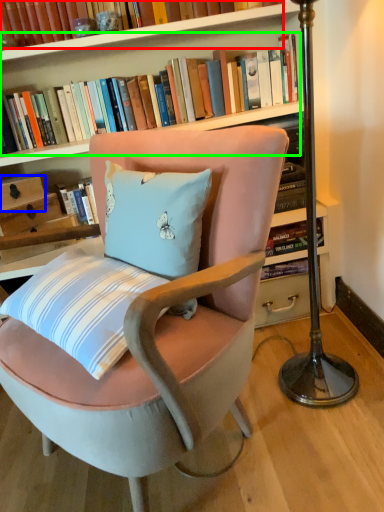
Question: Estimate the real-world distances between objects in this image. Which object is farther from book (highlighted by a red box), drawer (highlighted by a blue box) or book (highlighted by a green box)?

Choices:
 (A) drawer
 (B) book

Answer: (A)